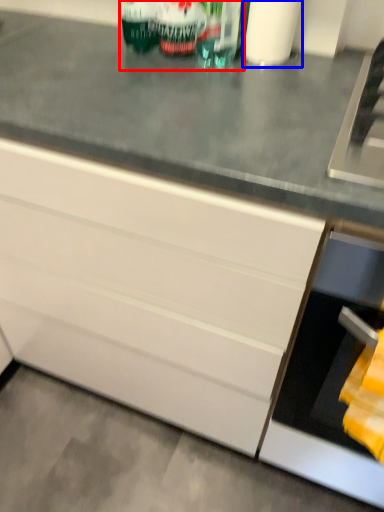
Question: Which of the following is the farthest to the observer, beverage (highlighted by a red box) or toilet paper (highlighted by a blue box)?

Choices:
 (A) beverage
 (B) toilet paper

Answer: (A)